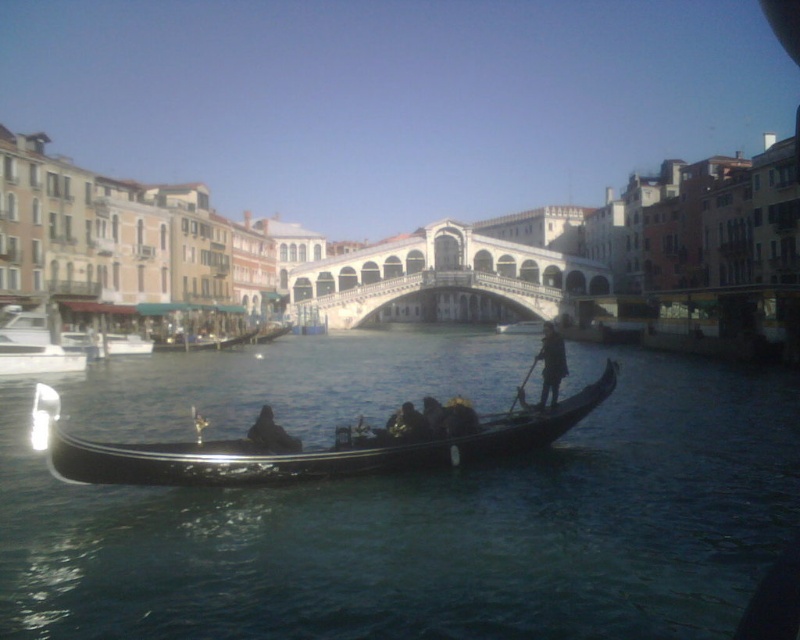
Between point (656, 560) and point (336, 257), which one is positioned in front?

Point (656, 560) is more forward.

Based on the photo, does black water at center have a lesser height compared to white stone bridge at center?

In fact, black water at center may be taller than white stone bridge at center.

Which is in front, point (420, 358) or point (394, 276)?

Point (420, 358) is more forward.

Where is `black water at center`? This screenshot has width=800, height=640. black water at center is located at coordinates (x=432, y=531).

Between black water at center and dark blue fabric at center, which one is positioned lower?

black water at center

What do you see at coordinates (432, 531) in the screenshot?
I see `black water at center` at bounding box center [432, 531].

Who is more forward, [628,592] or [552,403]?

Point [628,592] is more forward.

You are a GUI agent. You are given a task and a screenshot of the screen. Output one action in this format:
    pyautogui.click(x=<x>, y=<y>)
    Task: Click on the black water at center
    
    Given the screenshot: What is the action you would take?
    pyautogui.click(x=432, y=531)

Is the position of dark brown leather hat at center less distant than that of dark brown leather jacket at center?

Yes, dark brown leather hat at center is in front of dark brown leather jacket at center.

Which is more to the left, dark brown leather hat at center or dark brown leather jacket at center?

dark brown leather hat at center is more to the left.

You are a GUI agent. You are given a task and a screenshot of the screen. Output one action in this format:
    pyautogui.click(x=<x>, y=<y>)
    Task: Click on the dark brown leather hat at center
    This screenshot has height=640, width=800.
    Given the screenshot: What is the action you would take?
    pyautogui.click(x=270, y=435)